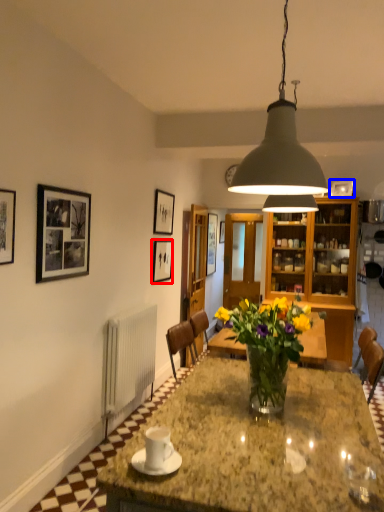
Question: Which object is further to the camera taking this photo, picture frame (highlighted by a red box) or picture frame (highlighted by a blue box)?

Choices:
 (A) picture frame
 (B) picture frame

Answer: (B)